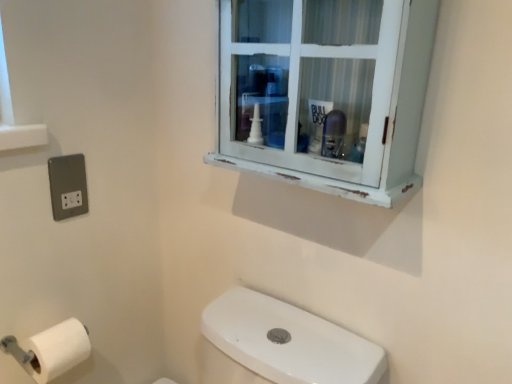
Question: From a real-world perspective, is white distressed cabinet at upper center positioned above or below white matte toilet paper at lower left?

Choices:
 (A) below
 (B) above

Answer: (B)

Question: Looking at their shapes, would you say white distressed cabinet at upper center is wider or thinner than white matte toilet paper at lower left?

Choices:
 (A) thin
 (B) wide

Answer: (B)

Question: Estimate the real-world distances between objects in this image. Which object is closer to the white distressed cabinet at upper center?

Choices:
 (A) satin silver socket at lower left
 (B) white matte toilet paper at lower left

Answer: (A)

Question: Based on their relative distances, which object is nearer to the white distressed cabinet at upper center?

Choices:
 (A) satin silver socket at lower left
 (B) white matte toilet paper at lower left

Answer: (A)